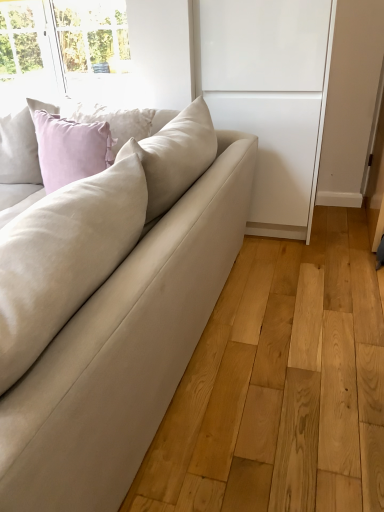
The width and height of the screenshot is (384, 512). What do you see at coordinates (271, 97) in the screenshot?
I see `white matte cabinet at center` at bounding box center [271, 97].

Identify the location of white matte cabinet at center. This screenshot has height=512, width=384. coord(271,97).

Measure the distance between point (252, 82) and camera.

Point (252, 82) and camera are 6.91 feet apart from each other.

This screenshot has height=512, width=384. Find the location of `beige fabric couch at center`. beige fabric couch at center is located at coordinates click(111, 308).

What do you see at coordinates (111, 308) in the screenshot? The width and height of the screenshot is (384, 512). I see `beige fabric couch at center` at bounding box center [111, 308].

I want to click on white matte cabinet at center, so click(271, 97).

Considering the positions of objects white matte cabinet at center and beige fabric couch at center in the image provided, who is more to the left, white matte cabinet at center or beige fabric couch at center?

From the viewer's perspective, beige fabric couch at center appears more on the left side.

Considering the relative positions of white matte cabinet at center and beige fabric couch at center in the image provided, is white matte cabinet at center behind beige fabric couch at center?

Yes, it is.

Is point (271, 55) in front of point (165, 245)?

No, (271, 55) is further to viewer.

From the image's perspective, does white matte cabinet at center appear lower than beige fabric couch at center?

Actually, white matte cabinet at center appears above beige fabric couch at center in the image.

From a real-world perspective, is white matte cabinet at center positioned above or below beige fabric couch at center?

white matte cabinet at center is above beige fabric couch at center.

In the scene shown: Which of these two, white matte cabinet at center or beige fabric couch at center, is thinner?

white matte cabinet at center is thinner.

From their relative heights in the image, would you say white matte cabinet at center is taller or shorter than beige fabric couch at center?

Considering their sizes, white matte cabinet at center has more height than beige fabric couch at center.

Considering the relative sizes of white matte cabinet at center and beige fabric couch at center in the image provided, is white matte cabinet at center smaller than beige fabric couch at center?

Yes.

Is white matte cabinet at center spatially inside beige fabric couch at center, or outside of it?

white matte cabinet at center is not enclosed by beige fabric couch at center.

Is white matte cabinet at center directly adjacent to beige fabric couch at center?

No.

Is white matte cabinet at center oriented away from beige fabric couch at center?

That's not correct — white matte cabinet at center is not looking away from beige fabric couch at center.

Can you tell me how much white matte cabinet at center and beige fabric couch at center differ in facing direction?

They differ by 0.573 degrees in their facing directions.

I want to click on studio couch below the white matte cabinet at center (from the image's perspective), so pyautogui.click(x=111, y=308).

Is beige fabric couch at center to the left of white matte cabinet at center from the viewer's perspective?

Yes.

From the picture: Relative to white matte cabinet at center, is beige fabric couch at center in front or behind?

Clearly, beige fabric couch at center is in front of white matte cabinet at center.

Considering the points (194, 215) and (209, 71), which point is in front, point (194, 215) or point (209, 71)?

The point (194, 215) is more forward.

From the image's perspective, relative to white matte cabinet at center, is beige fabric couch at center above or below?

Clearly, from the image's perspective, beige fabric couch at center is below white matte cabinet at center.

From a real-world perspective, is beige fabric couch at center physically located above or below white matte cabinet at center?

beige fabric couch at center is below white matte cabinet at center.

Can you confirm if beige fabric couch at center is thinner than white matte cabinet at center?

No.

Considering the relative sizes of beige fabric couch at center and white matte cabinet at center in the image provided, is beige fabric couch at center shorter than white matte cabinet at center?

Indeed, beige fabric couch at center has a lesser height compared to white matte cabinet at center.

Considering the relative sizes of beige fabric couch at center and white matte cabinet at center in the image provided, is beige fabric couch at center smaller than white matte cabinet at center?

Actually, beige fabric couch at center might be larger than white matte cabinet at center.

Is white matte cabinet at center located within beige fabric couch at center?

Actually, white matte cabinet at center is outside beige fabric couch at center.

Are beige fabric couch at center and white matte cabinet at center far apart?

No, beige fabric couch at center is in close proximity to white matte cabinet at center.

Does beige fabric couch at center turn towards white matte cabinet at center?

No.

How far apart are beige fabric couch at center and white matte cabinet at center?

35.17 inches.

Where is `screen door above the beige fabric couch at center (from a real-world perspective)`? This screenshot has height=512, width=384. screen door above the beige fabric couch at center (from a real-world perspective) is located at coordinates (271, 97).

Find the location of a particular element. The width and height of the screenshot is (384, 512). screen door lying above the beige fabric couch at center (from the image's perspective) is located at coordinates (271, 97).

The image size is (384, 512). In order to click on studio couch on the left of the white matte cabinet at center in this screenshot , I will do `click(111, 308)`.